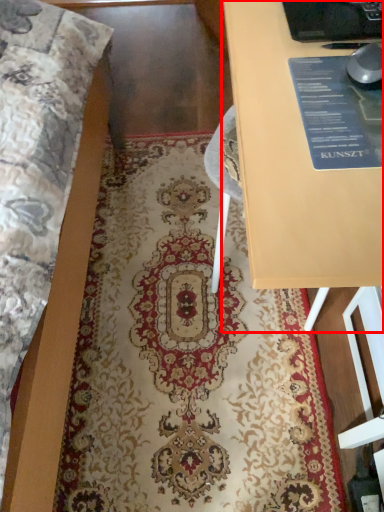
Question: Where is table (annotated by the red box) located in relation to mat in the image?

Choices:
 (A) right
 (B) left

Answer: (A)